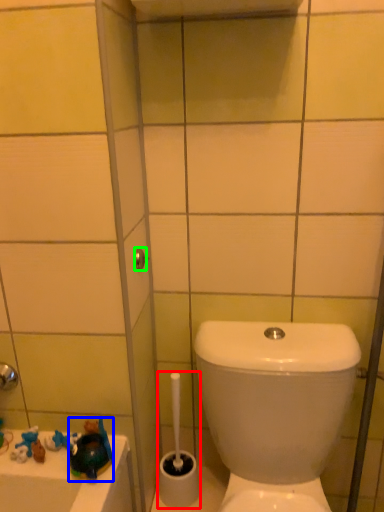
Question: Which object is positioned closest to brush (highlighted by a red box)? Select from toy (highlighted by a blue box) and shower (highlighted by a green box).

Choices:
 (A) toy
 (B) shower

Answer: (A)